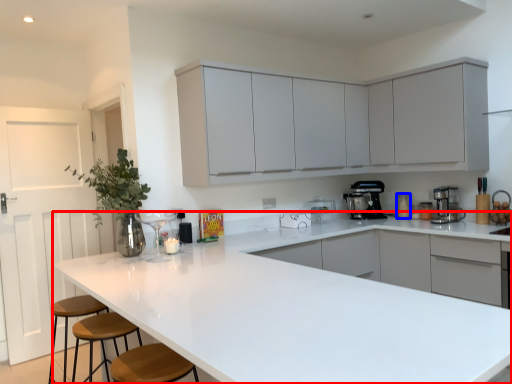
Question: Among these objects, which one is nearest to the camera, countertop (highlighted by a red box) or appliance (highlighted by a blue box)?

Choices:
 (A) countertop
 (B) appliance

Answer: (A)